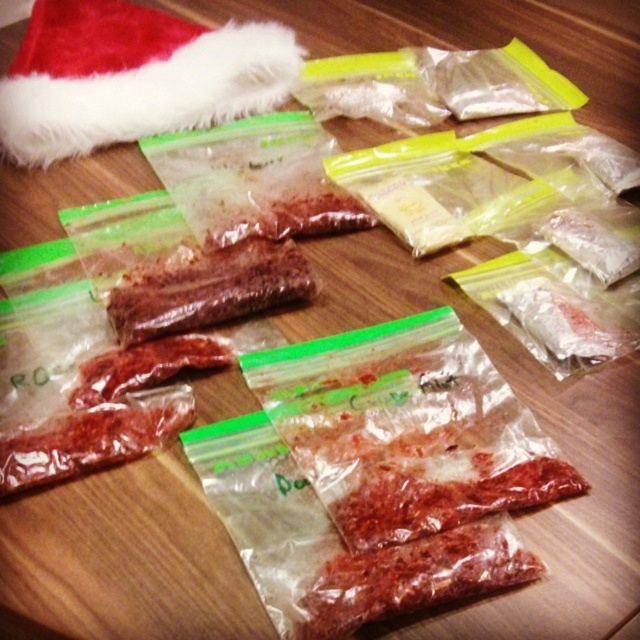
Question: Which point is farther from the camera taking this photo?

Choices:
 (A) (132, 280)
 (B) (486, 500)
 (C) (36, 451)

Answer: (A)

Question: From the image, what is the correct spatial relationship of red matte dried meat at lower left in relation to red matte dried meat at left?

Choices:
 (A) above
 (B) below

Answer: (B)

Question: Based on their relative distances, which object is nearer to the red matte dried meat at left?

Choices:
 (A) red matte dried meat at lower left
 (B) translucent plastic bag at center
 (C) red matte dried meat at center

Answer: (A)

Question: Is red matte meat at center below red matte dried meat at center?

Choices:
 (A) no
 (B) yes

Answer: (B)

Question: Which of the following is the farthest from the observer?

Choices:
 (A) (262, 260)
 (B) (472, 532)
 (C) (173, 422)

Answer: (A)

Question: Observing the image, what is the correct spatial positioning of red matte dried meat at center in reference to red matte dried meat at lower left?

Choices:
 (A) right
 (B) left

Answer: (A)